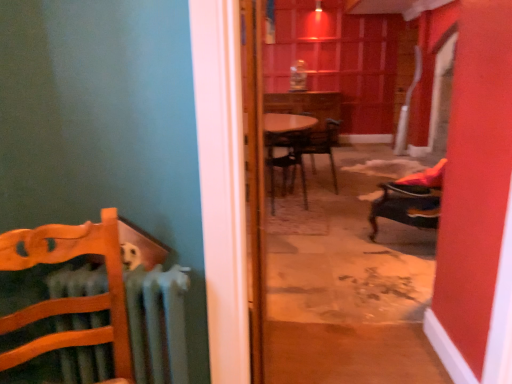
Question: Is wooden chair at left, placed as the 4th chair when sorted from back to front, taller than wooden door at center?

Choices:
 (A) no
 (B) yes

Answer: (A)

Question: Does wooden chair at left, placed as the 4th chair when sorted from back to front, have a smaller size compared to wooden door at center?

Choices:
 (A) no
 (B) yes

Answer: (B)

Question: Is wooden door at center located within wooden chair at left, placed as the 4th chair when sorted from back to front?

Choices:
 (A) no
 (B) yes

Answer: (A)

Question: Considering the relative sizes of wooden chair at left, placed as the 4th chair when sorted from back to front, and wooden door at center in the image provided, is wooden chair at left, placed as the 4th chair when sorted from back to front, wider than wooden door at center?

Choices:
 (A) no
 (B) yes

Answer: (B)

Question: From the image's perspective, would you say wooden chair at left, the first chair viewed from the front, is positioned over wooden door at center?

Choices:
 (A) no
 (B) yes

Answer: (A)

Question: Is wooden door at center wider or thinner than metallic dark brown chair at center, the 4th chair positioned from the front?

Choices:
 (A) wide
 (B) thin

Answer: (B)

Question: In the image, is wooden door at center on the left side or the right side of metallic dark brown chair at center, which is counted as the second chair, starting from the right?

Choices:
 (A) right
 (B) left

Answer: (B)

Question: From the image's perspective, relative to metallic dark brown chair at center, the first chair viewed from the back, is wooden door at center above or below?

Choices:
 (A) below
 (B) above

Answer: (A)

Question: Looking at the image, does wooden door at center seem bigger or smaller compared to metallic dark brown chair at center, marked as the third chair in a left-to-right arrangement?

Choices:
 (A) small
 (B) big

Answer: (A)

Question: From a real-world perspective, relative to wooden chair at left, the first chair viewed from the front, is metallic dark brown chair at center, the first chair viewed from the back, vertically above or below?

Choices:
 (A) below
 (B) above

Answer: (A)

Question: Is point (311, 145) closer or farther from the camera than point (82, 301)?

Choices:
 (A) farther
 (B) closer

Answer: (A)

Question: Is metallic dark brown chair at center, the first chair viewed from the back, wider or thinner than wooden chair at left, the 1th chair viewed from the left?

Choices:
 (A) wide
 (B) thin

Answer: (A)

Question: Is metallic dark brown chair at center, which is counted as the second chair, starting from the right, bigger or smaller than wooden chair at left, the 4th chair when ordered from right to left?

Choices:
 (A) small
 (B) big

Answer: (B)

Question: From their relative heights in the image, would you say wooden chair at left, the 4th chair when ordered from right to left, is taller or shorter than wooden door at center?

Choices:
 (A) short
 (B) tall

Answer: (A)

Question: From a real-world perspective, is wooden chair at left, the first chair viewed from the front, positioned above or below wooden door at center?

Choices:
 (A) below
 (B) above

Answer: (A)